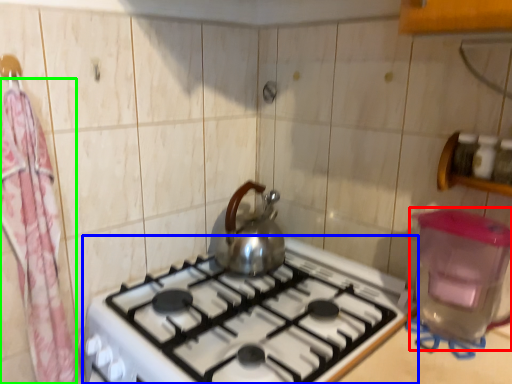
Question: Which object is positioned closest to water heater (highlighted by a red box)? Select from gas stove (highlighted by a blue box) and curtain (highlighted by a green box).

Choices:
 (A) gas stove
 (B) curtain

Answer: (A)